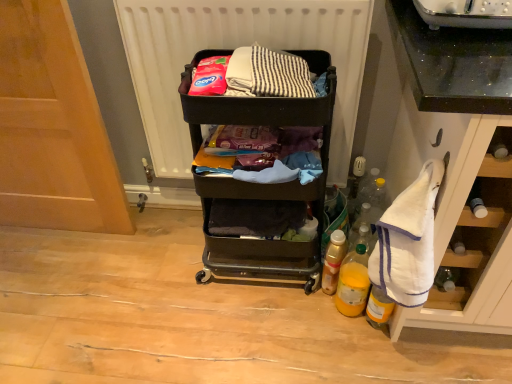
What are the coordinates of `vacant space underneath wooden at left (from a real-world perspective)` in the screenshot? It's located at (67, 222).